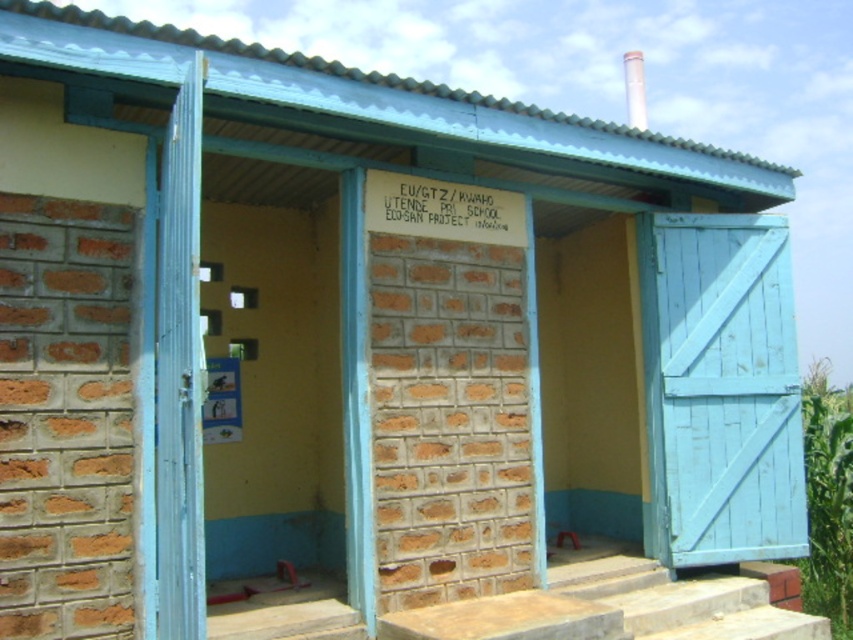
You are standing in front of the public restroom and need to enter. The entrance has a blue painted wood door at left and concrete steps at center. Which object should you approach first to enter the restroom?

You should approach the blue painted wood door at left first since it is the entrance door located to the left of the concrete steps at center.

You are a contractor measuring the entrance of the public restroom. You need to install a new door frame that must be wider than the existing door. Given the current setup, is the concrete steps at center wider than the light blue wooden door at center?

The light blue wooden door at center has a width less than the concrete steps at center, so yes, the concrete steps at center is wider than the light blue wooden door at center. The contractor can use the width of the steps as a reference for the new door frame.